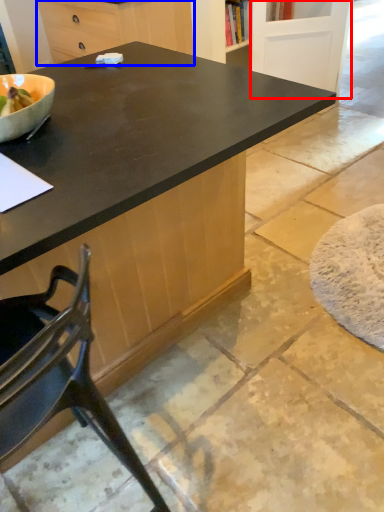
Question: Among these objects, which one is farthest to the camera, screen door (highlighted by a red box) or cabinetry (highlighted by a blue box)?

Choices:
 (A) screen door
 (B) cabinetry

Answer: (A)